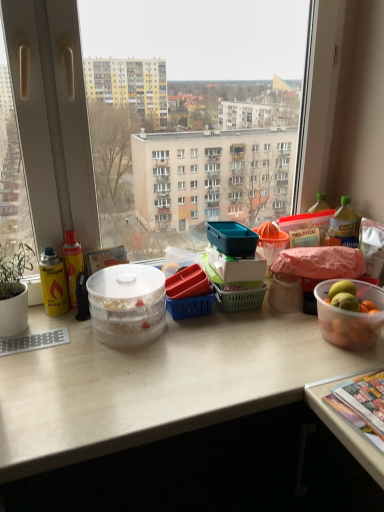
Find the location of a particular element. vacant space situated on the left part of transparent plastic bowl at center, marked as the first bowl in a left-to-right arrangement is located at coordinates (49, 337).